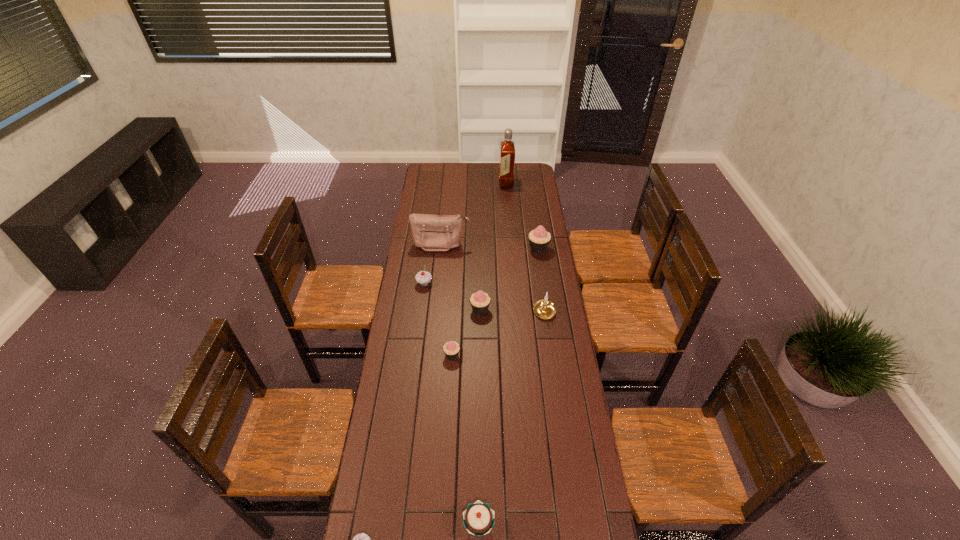
Where is `cupcake that can be found as the sixth closest to the shoulder bag`? This screenshot has height=540, width=960. cupcake that can be found as the sixth closest to the shoulder bag is located at coordinates (361, 539).

Where is `cupcake that can be found as the sixth closest to the second tallest object`? cupcake that can be found as the sixth closest to the second tallest object is located at coordinates click(361, 539).

Choose which pink cupcake is the second nearest neighbor to the second nearest pink cupcake. Please provide its 2D coordinates. Your answer should be formatted as a tuple, i.e. [(x, y)], where the tuple contains the x and y coordinates of a point satisfying the conditions above.

[(539, 239)]

You are a GUI agent. You are given a task and a screenshot of the screen. Output one action in this format:
    pyautogui.click(x=<x>, y=<y>)
    Task: Click on the pink cupcake that is the nearest to the second farthest pink cupcake
    
    Given the screenshot: What is the action you would take?
    pyautogui.click(x=451, y=349)

At what (x,y) coordinates should I click in order to perform the action: click on free point that satisfies the following two spatial constraints: 1. on the front pocket of the third tallest object; 2. on the left side of the shoulder bag. Please return your answer as a coordinate pair (x, y). Looking at the image, I should click on (441, 249).

At what (x,y) coordinates should I click in order to perform the action: click on blank area in the image that satisfies the following two spatial constraints: 1. on the front pocket of the second pink cupcake from right to left; 2. on the right side of the shoulder bag. Please return your answer as a coordinate pair (x, y). This screenshot has height=540, width=960. Looking at the image, I should click on (435, 309).